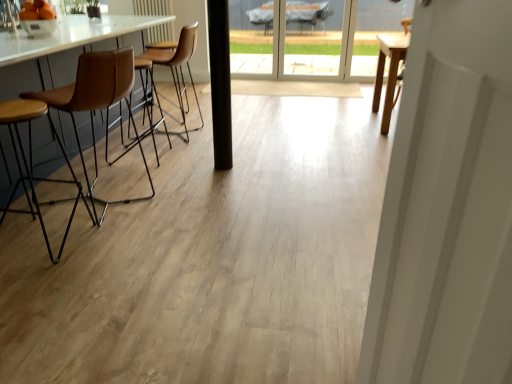
You are a GUI agent. You are given a task and a screenshot of the screen. Output one action in this format:
    pyautogui.click(x=<x>, y=<y>)
    Task: Click on the free space below brown leather chair at left, which is the 1th chair from back to front (from a real-world perspective)
    
    Given the screenshot: What is the action you would take?
    pyautogui.click(x=165, y=127)